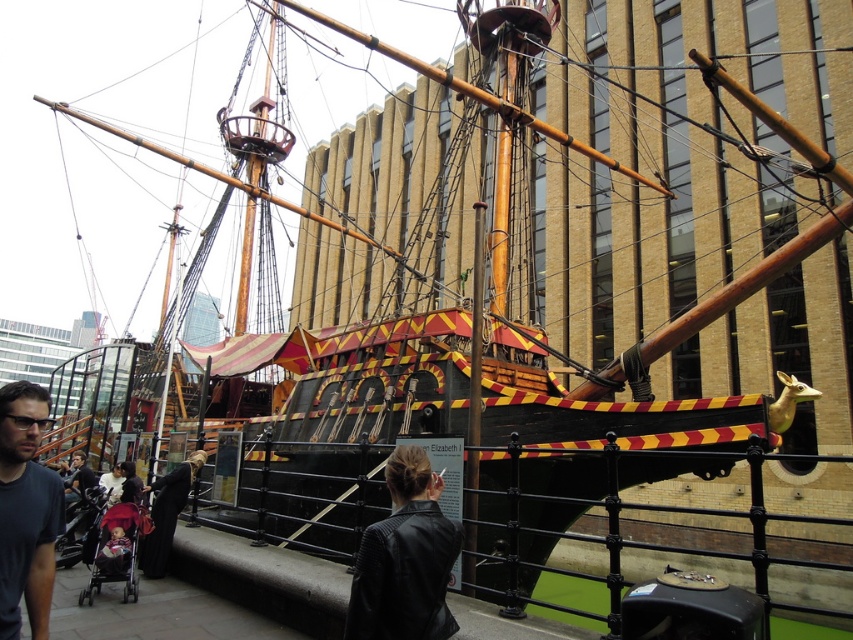
Question: Is black leather jacket at center to the right of dark gray t-shirt at left from the viewer's perspective?

Choices:
 (A) no
 (B) yes

Answer: (B)

Question: Observing the image, what is the correct spatial positioning of black leather jacket at center in reference to dark gray t-shirt at left?

Choices:
 (A) left
 (B) right

Answer: (B)

Question: Is black leather jacket at center to the left of dark gray t-shirt at left from the viewer's perspective?

Choices:
 (A) no
 (B) yes

Answer: (A)

Question: Which object is farther from the camera taking this photo?

Choices:
 (A) dark gray t-shirt at left
 (B) black leather jacket at center

Answer: (A)